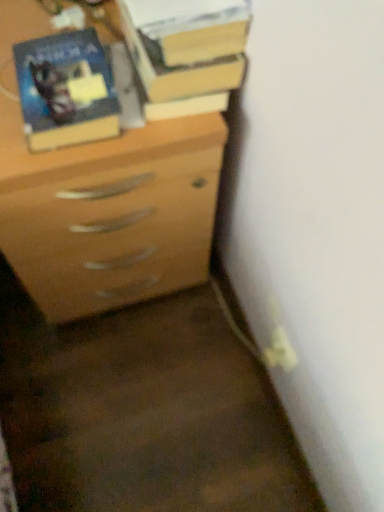
Question: Looking at the image, does matte wood chest of drawers at center seem bigger or smaller compared to matte black book at upper left?

Choices:
 (A) big
 (B) small

Answer: (A)

Question: Considering the positions of matte wood chest of drawers at center and matte black book at upper left in the image, is matte wood chest of drawers at center taller or shorter than matte black book at upper left?

Choices:
 (A) tall
 (B) short

Answer: (A)

Question: Estimate the real-world distances between objects in this image. Which object is closer to the hardcover book at upper center?

Choices:
 (A) matte black book at upper left
 (B) matte wood chest of drawers at center

Answer: (A)

Question: Which is nearer to the matte wood chest of drawers at center?

Choices:
 (A) matte black book at upper left
 (B) hardcover book at upper center

Answer: (A)